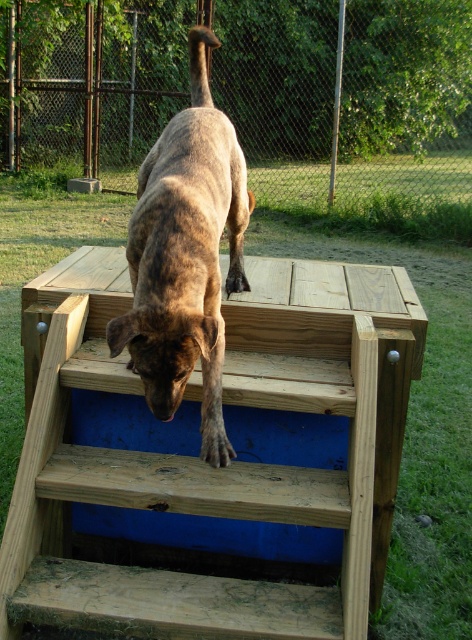
You are standing in front of the wooden stairs at center and the brown brindle dog at center. If you want to reach the dog first, which path should you take?

You should head towards the brown brindle dog at center first because it is closer to you than the wooden stairs at center, which are further away.

Based on the scene description, where is the wooden stairs at center in relation to the brown brindle dog at center?

The wooden stairs at center are to the right of the brown brindle dog at center.

Based on the scene, can you determine if the brown brindle dog at center is above or below the wooden stairs at center?

The wooden stairs at center is located below the brown brindle dog at center, so the dog is above the stairs.